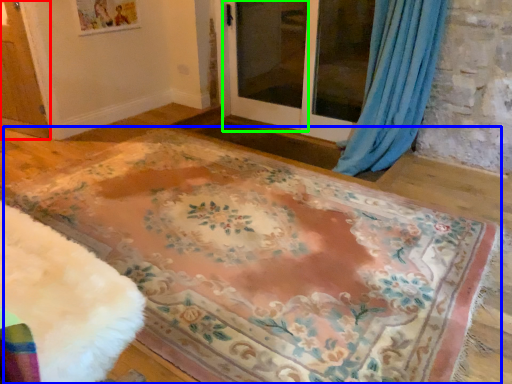
Question: Which is farther away from screen door (highlighted by a red box)? mat (highlighted by a blue box) or screen door (highlighted by a green box)?

Choices:
 (A) mat
 (B) screen door

Answer: (B)